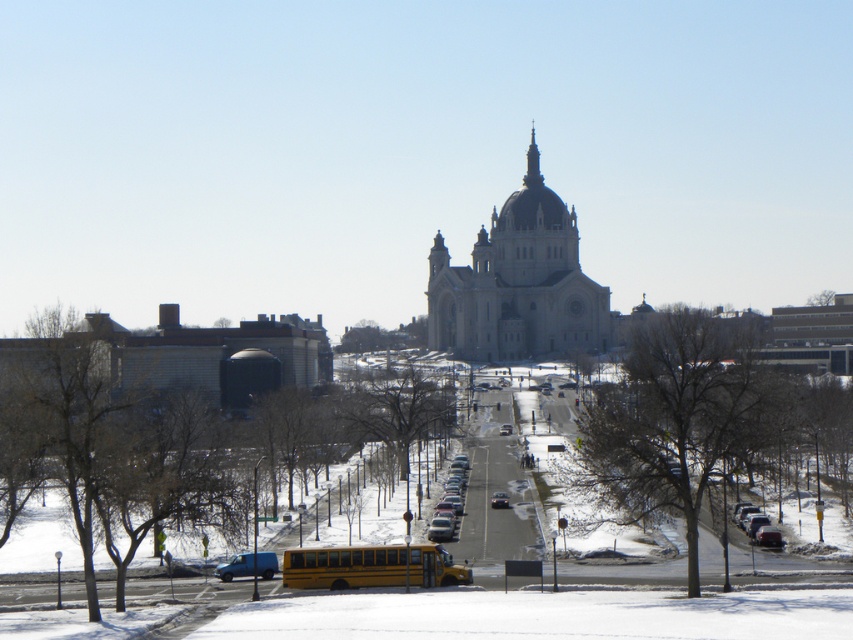
Does white stone church at center have a larger size compared to yellow matte/solid school bus at center?

Indeed, white stone church at center has a larger size compared to yellow matte/solid school bus at center.

Does point (456, 312) lie behind point (422, 579)?

Yes, point (456, 312) is farther from viewer.

Find the location of a particular element. white stone church at center is located at coordinates (518, 284).

Based on the photo, does yellow matte/solid school bus at center have a lesser height compared to blue matte van at lower left?

Yes, yellow matte/solid school bus at center is shorter than blue matte van at lower left.

Is yellow matte/solid school bus at center thinner than blue matte van at lower left?

Correct, yellow matte/solid school bus at center's width is less than blue matte van at lower left's.

Who is more forward, (300, 584) or (260, 561)?

Point (300, 584) is in front.

You are a GUI agent. You are given a task and a screenshot of the screen. Output one action in this format:
    pyautogui.click(x=<x>, y=<y>)
    Task: Click on the yellow matte/solid school bus at center
    The width and height of the screenshot is (853, 640).
    Given the screenshot: What is the action you would take?
    pyautogui.click(x=372, y=566)

Measure the distance between point (465, 465) and camera.

Point (465, 465) and camera are 390.13 feet apart.

Does matte black car at center have a greater width compared to blue matte van at lower left?

Yes, matte black car at center is wider than blue matte van at lower left.

Locate an element on the screen. matte black car at center is located at coordinates (451, 497).

I want to click on matte black car at center, so click(x=451, y=497).